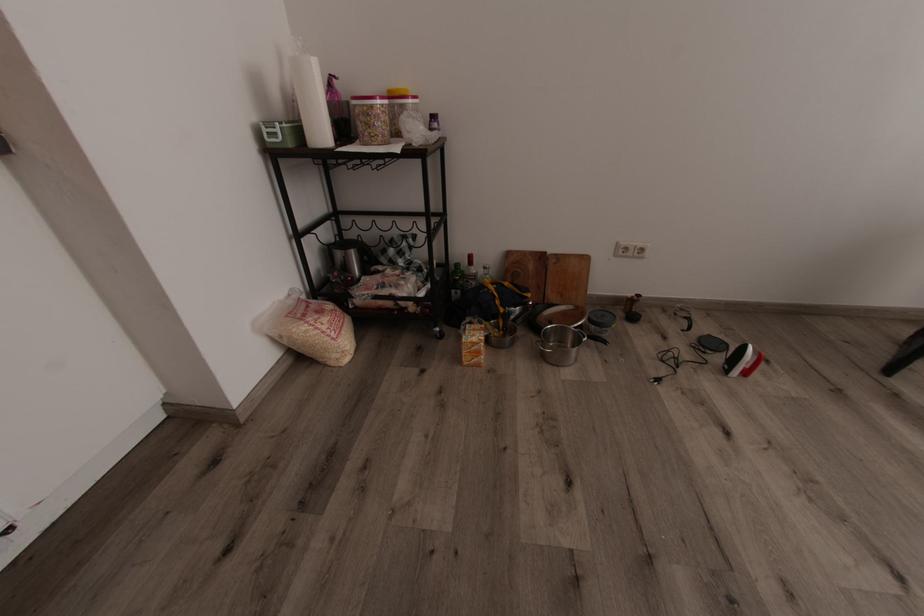
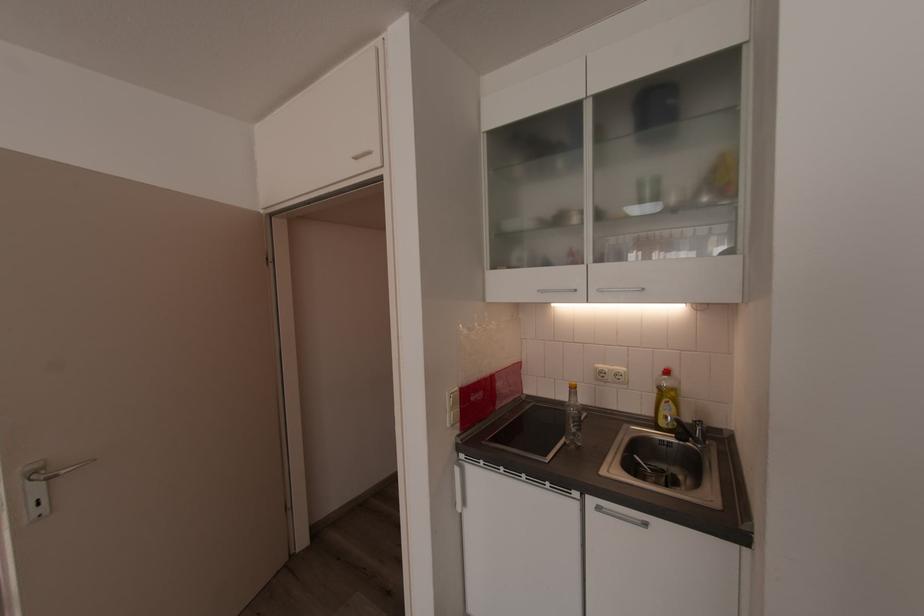
How did the camera likely rotate?

The camera rotated toward left-down.